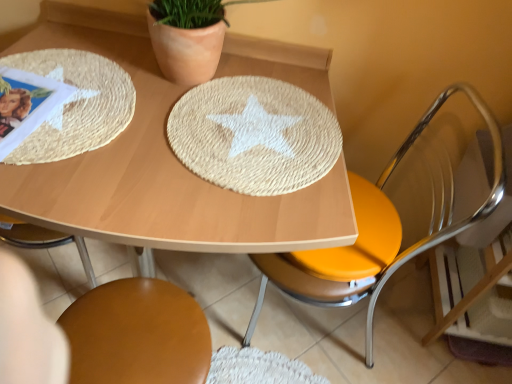
You are a GUI agent. You are given a task and a screenshot of the screen. Output one action in this format:
    pyautogui.click(x=<x>, y=<y>)
    Task: Click on the free space above raffia textured placemat at upper left (from a real-world perspective)
    The height and width of the screenshot is (384, 512).
    Given the screenshot: What is the action you would take?
    pyautogui.click(x=62, y=97)